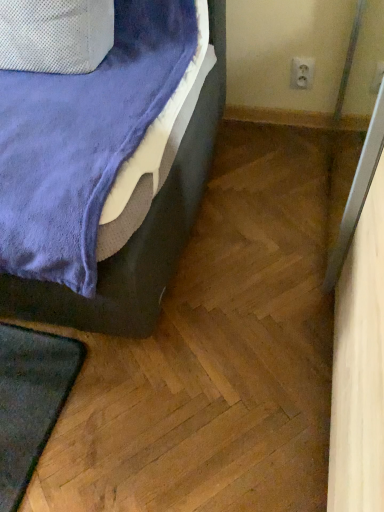
Question: Is white plastic electric outlet at upper right at the left side of velvet blue bed at lower left?

Choices:
 (A) yes
 (B) no

Answer: (B)

Question: From a real-world perspective, is white plastic electric outlet at upper right located beneath velvet blue bed at lower left?

Choices:
 (A) yes
 (B) no

Answer: (A)

Question: Is white plastic electric outlet at upper right to the right of velvet blue bed at lower left from the viewer's perspective?

Choices:
 (A) no
 (B) yes

Answer: (B)

Question: Is white plastic electric outlet at upper right not near velvet blue bed at lower left?

Choices:
 (A) no
 (B) yes

Answer: (A)

Question: Does white plastic electric outlet at upper right have a smaller size compared to velvet blue bed at lower left?

Choices:
 (A) no
 (B) yes

Answer: (B)

Question: Is white plastic electric outlet at upper right turned away from velvet blue bed at lower left?

Choices:
 (A) no
 (B) yes

Answer: (A)

Question: Considering the relative sizes of velvet blue bed at lower left and white plastic electric outlet at upper right in the image provided, is velvet blue bed at lower left wider than white plastic electric outlet at upper right?

Choices:
 (A) no
 (B) yes

Answer: (B)

Question: From the image's perspective, is velvet blue bed at lower left on top of white plastic electric outlet at upper right?

Choices:
 (A) yes
 (B) no

Answer: (B)

Question: From a real-world perspective, is velvet blue bed at lower left over white plastic electric outlet at upper right?

Choices:
 (A) yes
 (B) no

Answer: (A)

Question: Is velvet blue bed at lower left positioned before white plastic electric outlet at upper right?

Choices:
 (A) no
 (B) yes

Answer: (B)

Question: Can you confirm if velvet blue bed at lower left is shorter than white plastic electric outlet at upper right?

Choices:
 (A) yes
 (B) no

Answer: (B)

Question: Is white plastic electric outlet at upper right at the back of velvet blue bed at lower left?

Choices:
 (A) no
 (B) yes

Answer: (A)

Question: From the image's perspective, relative to velvet blue bed at lower left, is white plastic electric outlet at upper right above or below?

Choices:
 (A) below
 (B) above

Answer: (B)